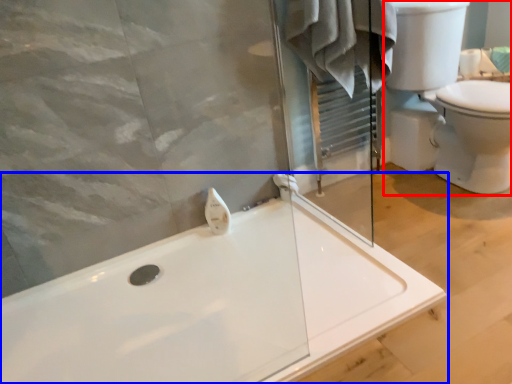
Question: Which of the following is the farthest to the observer, sink (highlighted by a red box) or bathtub (highlighted by a blue box)?

Choices:
 (A) sink
 (B) bathtub

Answer: (A)